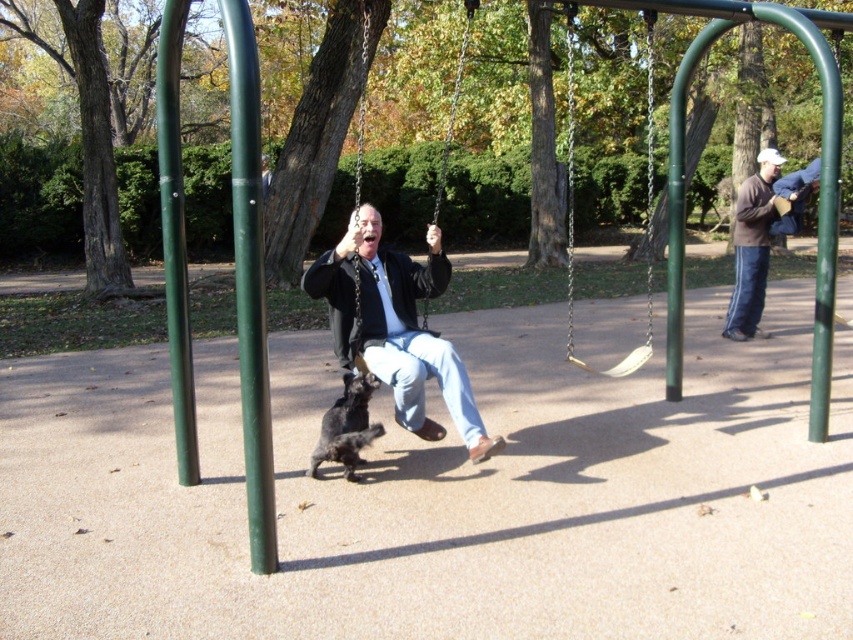
Between green metallic pole at left and brown sweater at right, which one has less height?

With less height is green metallic pole at left.

Who is lower down, green metallic pole at left or brown sweater at right?

Positioned lower is brown sweater at right.

Is point (169, 220) farther from camera compared to point (755, 305)?

That is False.

Identify the location of green metallic pole at left. (175, 237).

Does green metallic pole at center appear under brown sweater at right?

Yes, green metallic pole at center is below brown sweater at right.

Is green metallic pole at center wider than brown sweater at right?

Incorrect, green metallic pole at center's width does not surpass brown sweater at right's.

I want to click on green metallic pole at center, so click(x=250, y=282).

I want to click on green metallic pole at center, so coord(250,282).

Who is more distant from viewer, (321, 253) or (572, 42)?

Positioned behind is point (572, 42).

Between point (401, 328) and point (641, 348), which one is positioned behind?

The point (641, 348) is more distant.

You are a GUI agent. You are given a task and a screenshot of the screen. Output one action in this format:
    pyautogui.click(x=<x>, y=<y>)
    Task: Click on the matte black jacket at center
    
    Given the screenshot: What is the action you would take?
    pyautogui.click(x=397, y=326)